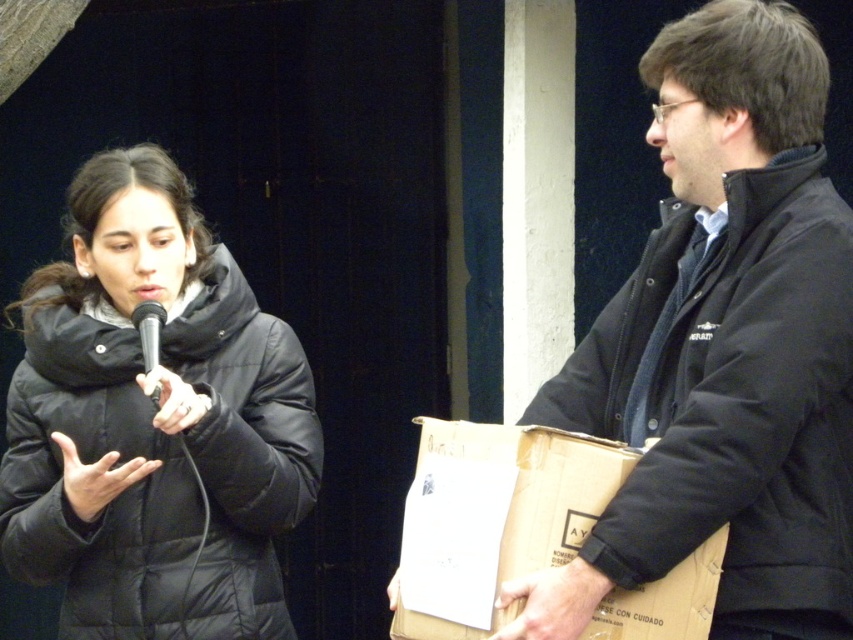
Which is in front, point (277, 468) or point (683, 589)?

Positioned in front is point (683, 589).

Can you confirm if black puffy jacket at center is positioned below brown cardboard box at right?

No.

Which is in front, point (184, 618) or point (718, 540)?

Point (718, 540) is more forward.

Image resolution: width=853 pixels, height=640 pixels. I want to click on black puffy jacket at center, so click(x=91, y=461).

Between point (828, 572) and point (140, 406), which one is positioned in front?

Point (828, 572)

Who is lower down, black quilted jacket at right or black puffy jacket at center?

black puffy jacket at center

In the scene shown: Who is more forward, (x=669, y=292) or (x=51, y=458)?

Point (x=669, y=292) is in front.

Identify the location of black quilted jacket at right. (730, 403).

Image resolution: width=853 pixels, height=640 pixels. I want to click on black quilted jacket at right, so click(x=730, y=403).

Who is more distant from viewer, (712, 616) or (706, 634)?

The point (712, 616) is more distant.

Which is behind, point (614, 307) or point (653, 605)?

Positioned behind is point (614, 307).

Locate an element on the screen. black quilted jacket at right is located at coordinates (730, 403).